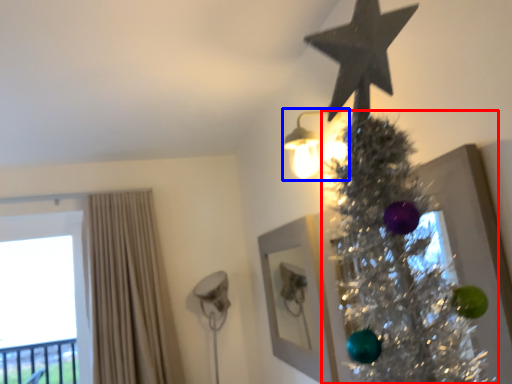
Question: Which point is further to the camera, christmas tree (highlighted by a red box) or light fixture (highlighted by a blue box)?

Choices:
 (A) christmas tree
 (B) light fixture

Answer: (B)